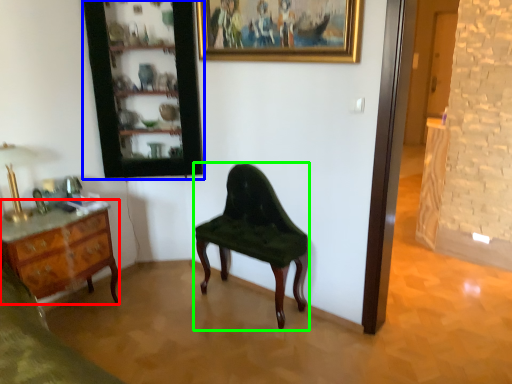
Question: Which object is the farthest from desk (highlighted by a red box)? Choose among these: cabinetry (highlighted by a blue box) or chair (highlighted by a green box).

Choices:
 (A) cabinetry
 (B) chair

Answer: (B)